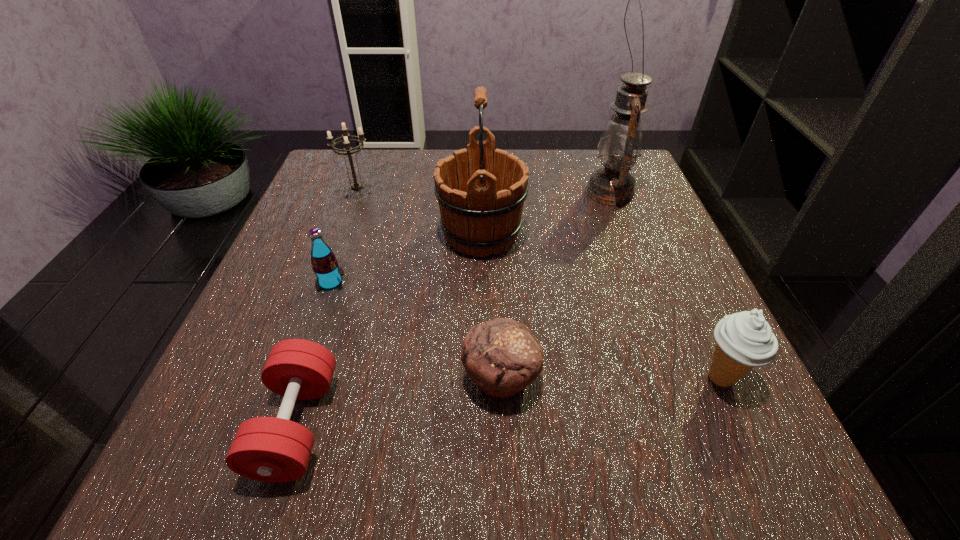
Locate an element on the screen. oil lamp that is at the right edge is located at coordinates (620, 145).

The image size is (960, 540). I want to click on icecream positioned at the right edge, so click(745, 340).

In order to click on object situated at the far left corner in this screenshot , I will do `click(356, 186)`.

Image resolution: width=960 pixels, height=540 pixels. I want to click on object positioned at the near left corner, so click(x=269, y=449).

This screenshot has width=960, height=540. In order to click on object that is at the far right corner in this screenshot , I will do `click(620, 145)`.

This screenshot has width=960, height=540. I want to click on free region at the far edge of the desktop, so click(x=565, y=180).

The height and width of the screenshot is (540, 960). In the image, there is a desktop. Identify the location of vacant area at the near edge. (645, 454).

In the image, there is a desktop. Where is `free region at the left edge`? free region at the left edge is located at coordinates (198, 407).

Where is `free space at the right edge`? free space at the right edge is located at coordinates (668, 313).

In the image, there is a desktop. At what (x,y) coordinates should I click in order to perform the action: click on vacant space at the near right corner. Please return your answer as a coordinate pair (x, y). This screenshot has height=540, width=960. Looking at the image, I should click on (708, 455).